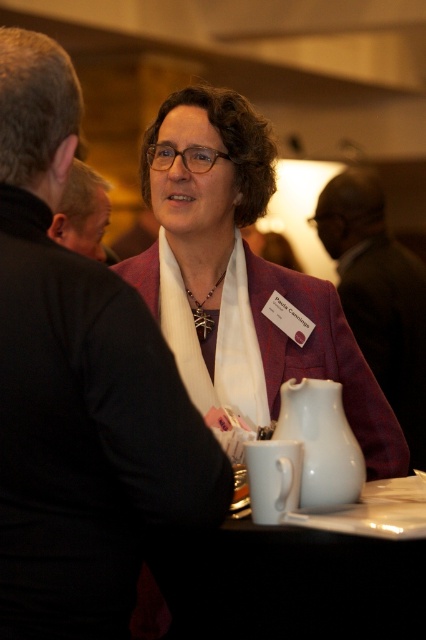
Consider the image. Is the position of white ceramic table at lower center less distant than that of white glossy teapot at lower center?

Yes, it is in front of white glossy teapot at lower center.

At what (x,y) coordinates should I click in order to perform the action: click on white ceramic table at lower center. Please return your answer as a coordinate pair (x, y). This screenshot has width=426, height=640. Looking at the image, I should click on (290, 582).

Is point (195, 586) positioned in front of point (325, 413)?

That is True.

Identify the location of white ceramic table at lower center. pyautogui.click(x=290, y=582).

Is matte purple jacket at center to the left of white glossy teapot at lower center from the viewer's perspective?

Correct, you'll find matte purple jacket at center to the left of white glossy teapot at lower center.

This screenshot has width=426, height=640. Describe the element at coordinates (241, 276) in the screenshot. I see `matte purple jacket at center` at that location.

I want to click on matte purple jacket at center, so click(241, 276).

Is matte purple jacket at center wider than white ceramic table at lower center?

Yes, matte purple jacket at center is wider than white ceramic table at lower center.

How distant is matte purple jacket at center from white ceramic table at lower center?

matte purple jacket at center is 68.02 centimeters away from white ceramic table at lower center.

Who is more forward, (227,163) or (394,589)?

Point (394,589) is more forward.

Image resolution: width=426 pixels, height=640 pixels. I want to click on matte purple jacket at center, so click(x=241, y=276).